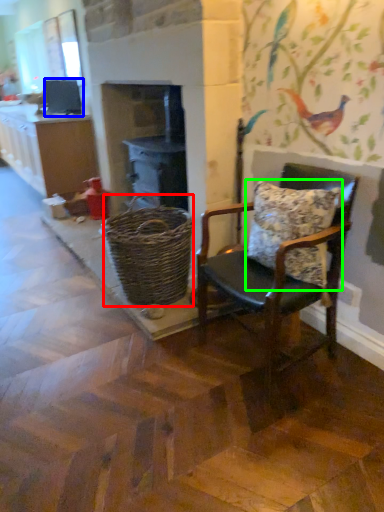
Question: Estimate the real-world distances between objects in this image. Which object is closer to basket (highlighted by a red box), appliance (highlighted by a blue box) or pillow (highlighted by a green box)?

Choices:
 (A) appliance
 (B) pillow

Answer: (B)